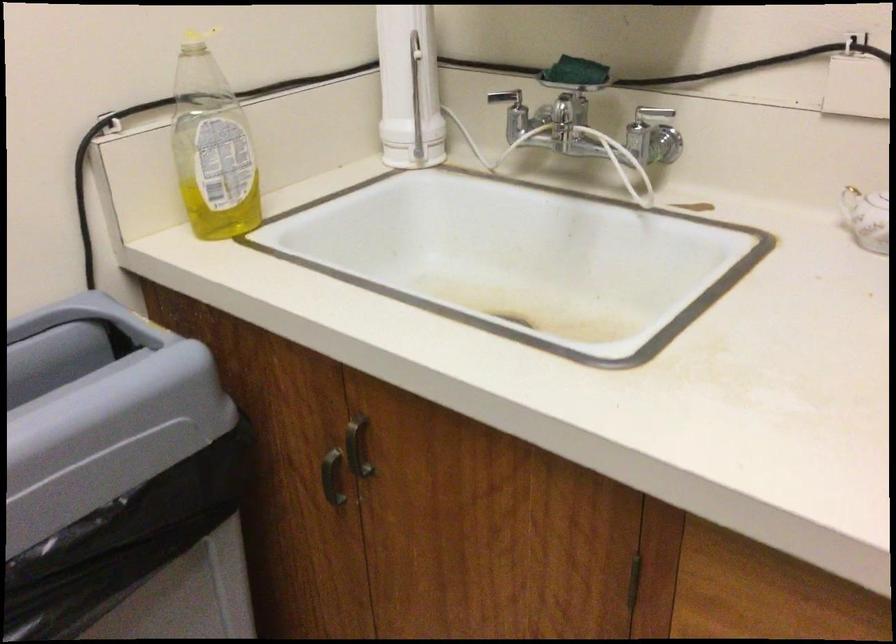
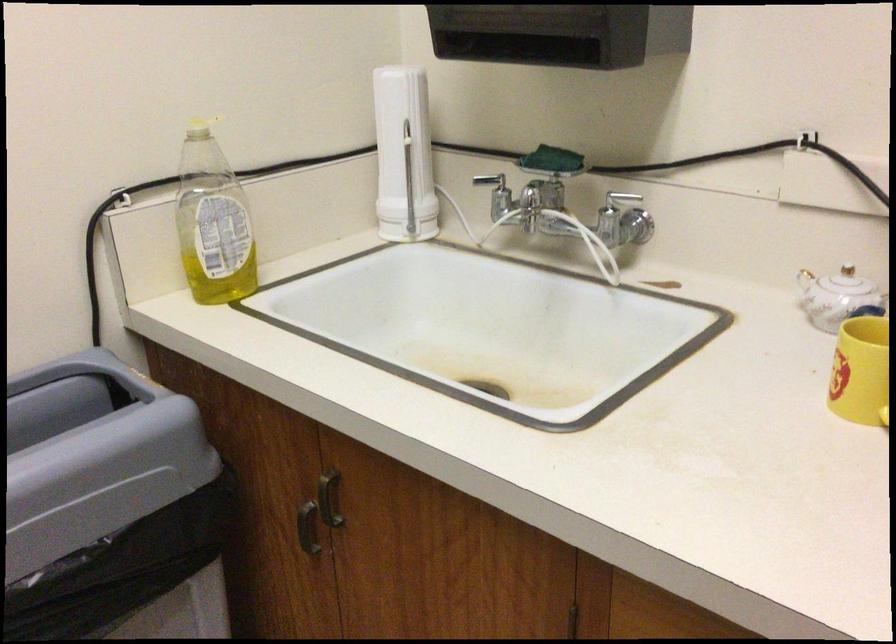
Find the pixel in the second image that matches (576,75) in the first image.

(552, 160)